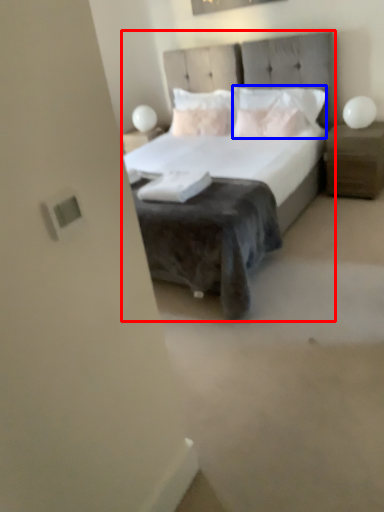
Question: Which object appears closest to the camera in this image, bed (highlighted by a red box) or pillow (highlighted by a blue box)?

Choices:
 (A) bed
 (B) pillow

Answer: (A)